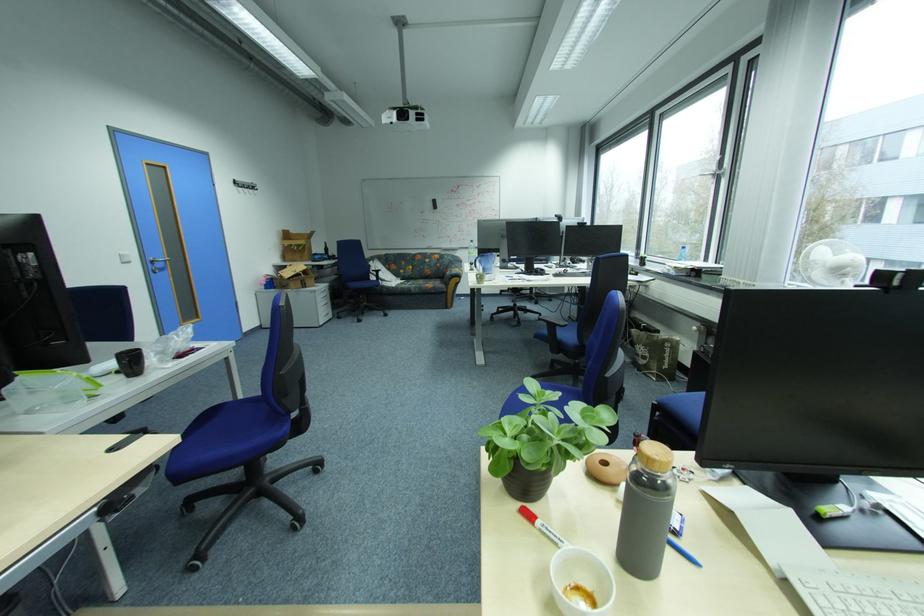
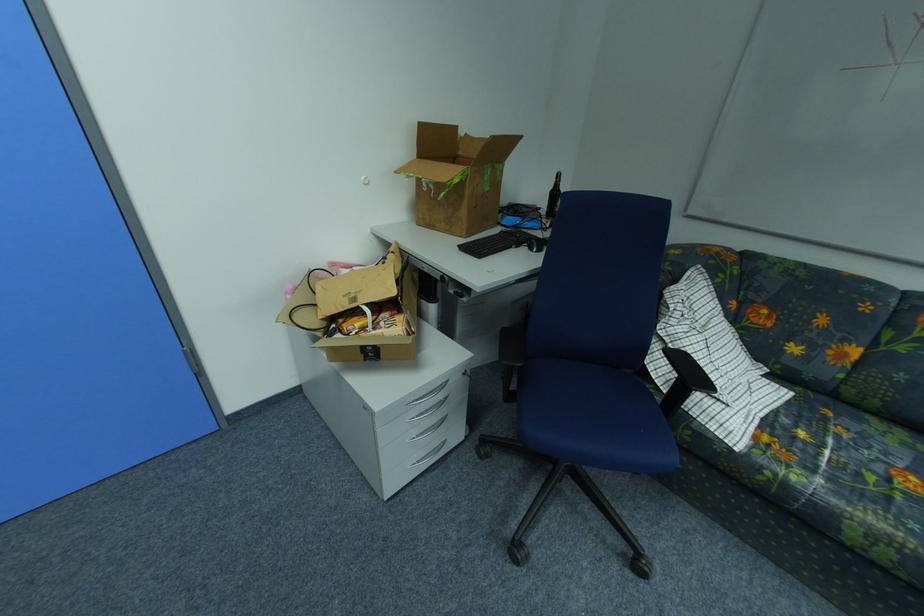
In the second image, find the point that corresponds to (x=334, y=248) in the first image.

(560, 188)